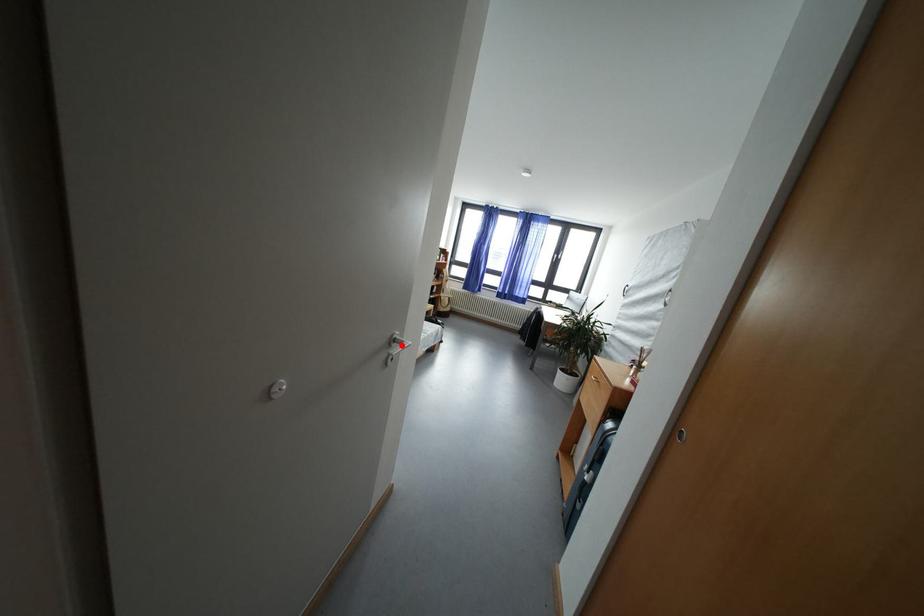
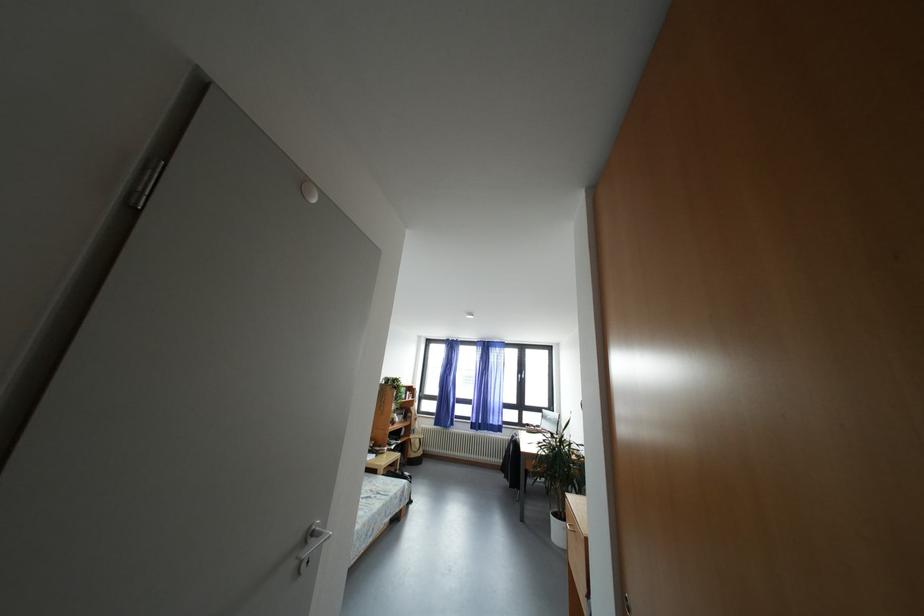
Find the pixel in the second image that matches the highlighted location in the first image.

(320, 539)